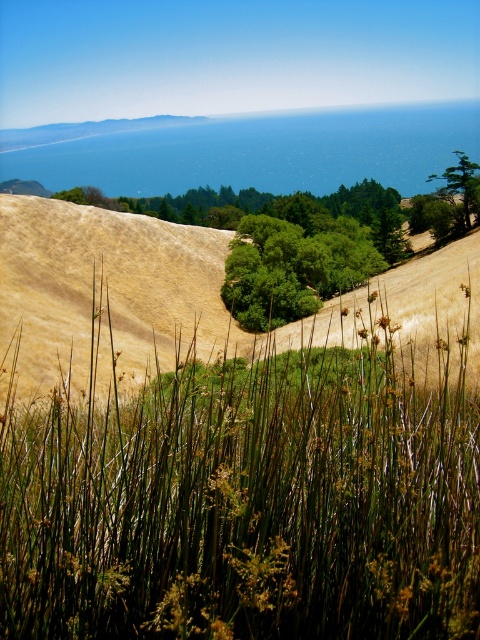
Question: Is blue water at upper center below green leafy tree at upper center?

Choices:
 (A) no
 (B) yes

Answer: (A)

Question: Observing the image, what is the correct spatial positioning of dry grass at center in reference to green leafy tree at upper center?

Choices:
 (A) below
 (B) above

Answer: (A)

Question: Which object appears farthest from the camera in this image?

Choices:
 (A) green leafy tree at upper center
 (B) dry grass at center
 (C) blue water at upper center

Answer: (C)

Question: Does dry grass at center appear under blue water at upper center?

Choices:
 (A) no
 (B) yes

Answer: (B)

Question: Among these points, which one is nearest to the camera?

Choices:
 (A) (10, 268)
 (B) (412, 173)
 (C) (462, 161)

Answer: (A)

Question: Based on their relative distances, which object is nearer to the green leafy tree at upper center?

Choices:
 (A) dry grass at center
 (B) blue water at upper center

Answer: (A)